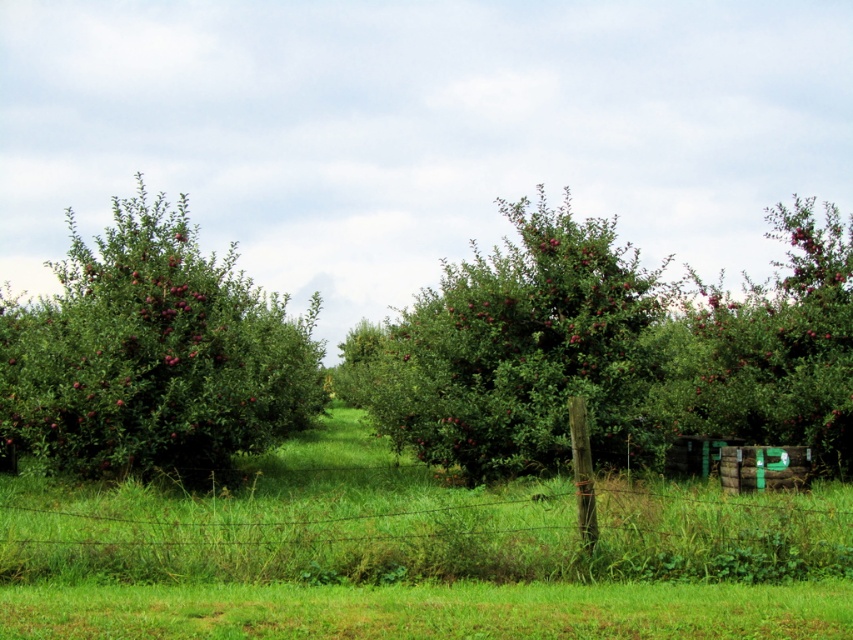
Question: Which object is farther from the camera taking this photo?

Choices:
 (A) green leafy tree at center
 (B) shiny red apples at left
 (C) barbed wire fence at lower center
 (D) smooth green crate at center

Answer: (D)

Question: Is barbed wire fence at lower center above smooth green crate at center?

Choices:
 (A) no
 (B) yes

Answer: (A)

Question: Among these points, which one is farthest from the camera?

Choices:
 (A) (120, 531)
 (B) (717, 371)

Answer: (B)

Question: Does barbed wire fence at lower center come in front of shiny red apples at left?

Choices:
 (A) no
 (B) yes

Answer: (B)

Question: Can you confirm if barbed wire fence at lower center is bigger than shiny red apples at left?

Choices:
 (A) no
 (B) yes

Answer: (A)

Question: Which point is closer to the camera?

Choices:
 (A) (515, 440)
 (B) (734, 364)
 (C) (184, 554)

Answer: (C)